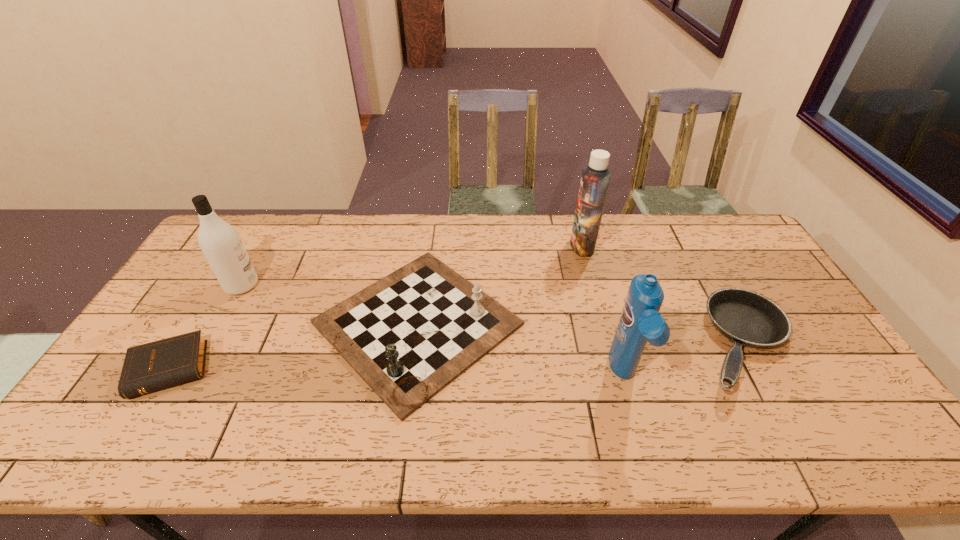
At what (x,y) coordinates should I click in order to perform the action: click on the farthest shampoo. Please return your answer as a coordinate pair (x, y). This screenshot has width=960, height=540. Looking at the image, I should click on (595, 178).

Locate an element on the screen. the leftmost shampoo is located at coordinates (220, 243).

Identify the location of the nearest shampoo. This screenshot has height=540, width=960. (640, 321).

Find the location of a particular element. The height and width of the screenshot is (540, 960). the fourth object from right to left is located at coordinates (409, 335).

The image size is (960, 540). I want to click on the fourth tallest object, so click(409, 335).

Find the location of a particular element. frying pan is located at coordinates (746, 318).

At what (x,y) coordinates should I click in order to perform the action: click on the rightmost object. Please return your answer as a coordinate pair (x, y). The image size is (960, 540). Looking at the image, I should click on (746, 318).

Where is `the shortest object`? The image size is (960, 540). the shortest object is located at coordinates (149, 367).

Find the location of a particular element. free spot located on the front label of the farthest shampoo is located at coordinates (510, 246).

I want to click on vacant space located 0.400m on the front label of the farthest shampoo, so click(x=455, y=246).